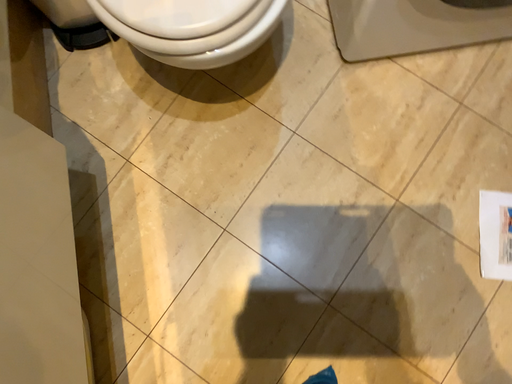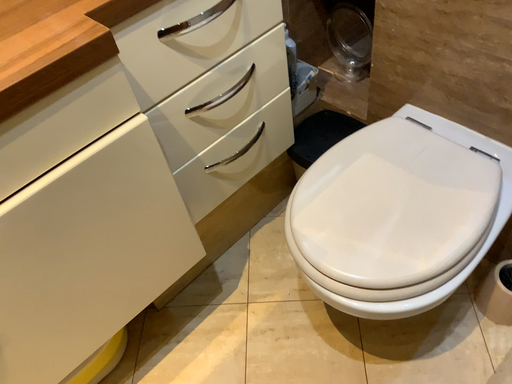
Question: Which way did the camera rotate in the video?

Choices:
 (A) rotated upward
 (B) rotated downward

Answer: (A)